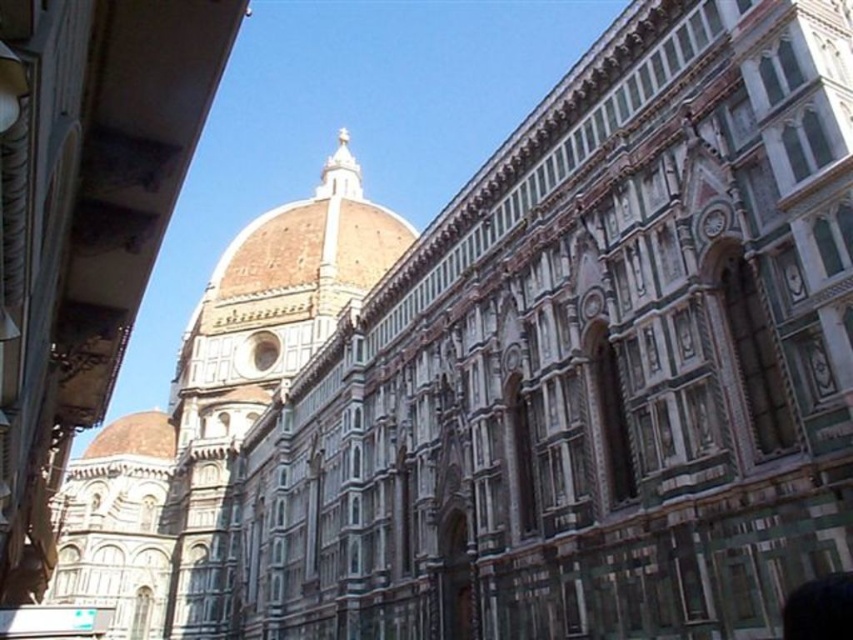
Question: Which of these objects is positioned farthest from the matte brown dome at center?

Choices:
 (A) white marble tower at center
 (B) brown marble dome at center

Answer: (B)

Question: Is brown marble dome at center to the right of white marble tower at center from the viewer's perspective?

Choices:
 (A) yes
 (B) no

Answer: (A)

Question: Based on their relative distances, which object is farther from the white marble tower at center?

Choices:
 (A) matte brown dome at center
 (B) brown marble dome at center

Answer: (B)

Question: Does brown marble dome at center appear under matte brown dome at center?

Choices:
 (A) yes
 (B) no

Answer: (B)

Question: Among these objects, which one is farthest from the camera?

Choices:
 (A) matte brown dome at center
 (B) brown marble dome at center

Answer: (A)

Question: Does white marble tower at center have a greater width compared to matte brown dome at center?

Choices:
 (A) yes
 (B) no

Answer: (A)